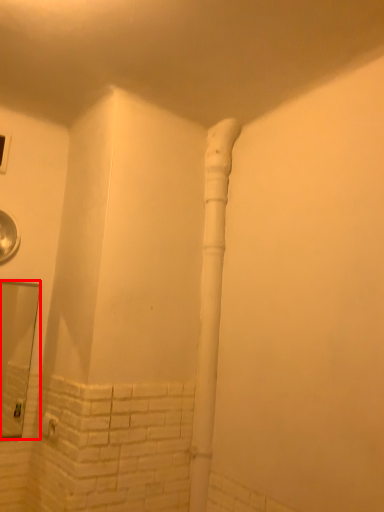
Question: Where is mirror (annotated by the red box) located in relation to water pipe in the image?

Choices:
 (A) left
 (B) right

Answer: (A)